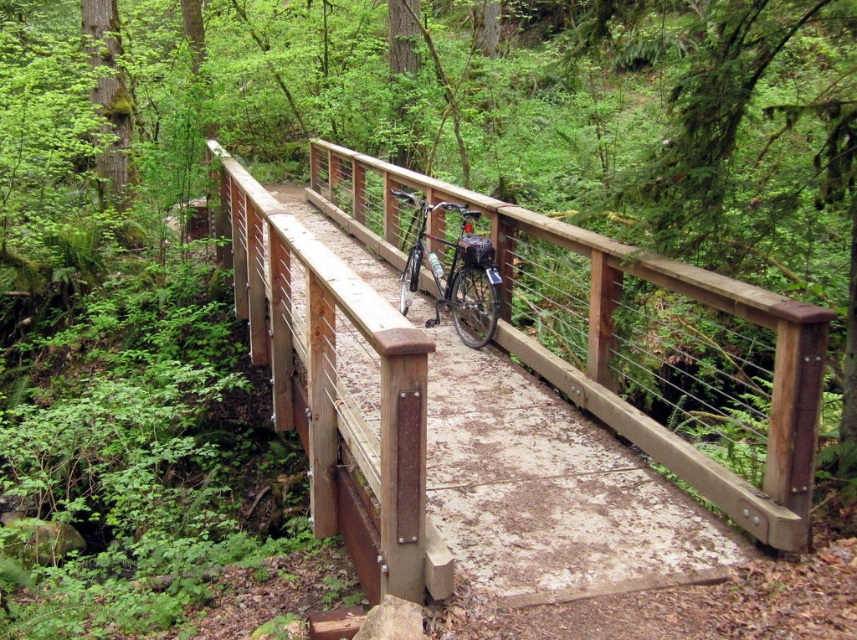
Question: Which point is farther to the camera?

Choices:
 (A) (424, 232)
 (B) (555, 417)

Answer: (A)

Question: Which point appears closest to the camera in this image?

Choices:
 (A) (400, 300)
 (B) (582, 524)

Answer: (B)

Question: Which of the following is the farthest from the observer?

Choices:
 (A) brown wooden bridge at center
 (B) silver metallic bicycle at center

Answer: (B)

Question: Is brown wooden bridge at center bigger than silver metallic bicycle at center?

Choices:
 (A) no
 (B) yes

Answer: (A)

Question: Does brown wooden bridge at center have a lesser width compared to silver metallic bicycle at center?

Choices:
 (A) no
 (B) yes

Answer: (B)

Question: Does brown wooden bridge at center appear on the left side of silver metallic bicycle at center?

Choices:
 (A) yes
 (B) no

Answer: (A)